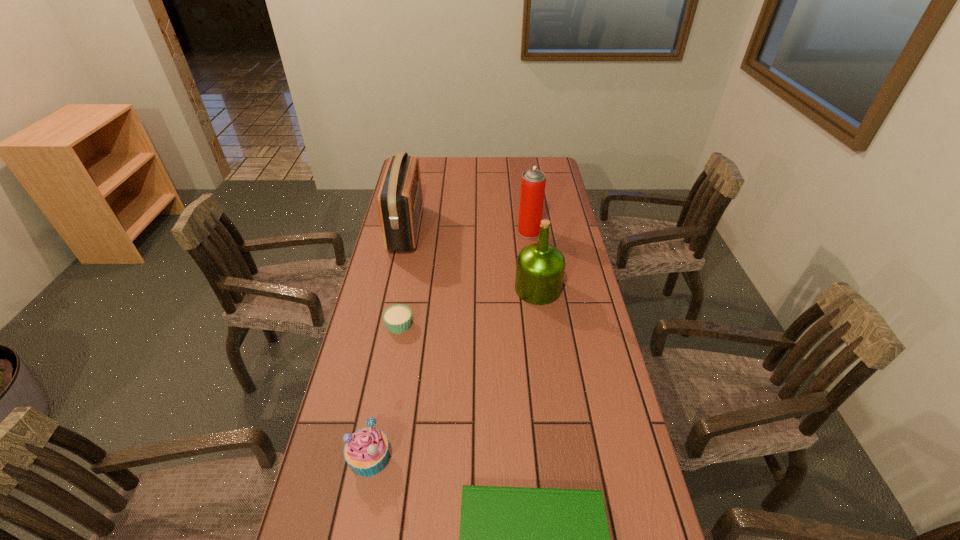
The width and height of the screenshot is (960, 540). I want to click on blank space that satisfies the following two spatial constraints: 1. on the front-facing side of the radio receiver; 2. on the left side of the second shortest object, so click(386, 325).

Find the location of `free space that satisfies the following two spatial constraints: 1. on the front-facing side of the fifth tallest object; 2. on the right side of the radio receiver`. free space that satisfies the following two spatial constraints: 1. on the front-facing side of the fifth tallest object; 2. on the right side of the radio receiver is located at coordinates (386, 325).

Find the location of a particular element. The width and height of the screenshot is (960, 540). free spot that satisfies the following two spatial constraints: 1. on the back side of the aerosol can; 2. on the front-facing side of the radio receiver is located at coordinates (529, 229).

Where is `vacant area in the image that satisfies the following two spatial constraints: 1. on the front-facing side of the aerosol can; 2. on the left side of the radio receiver`? This screenshot has width=960, height=540. vacant area in the image that satisfies the following two spatial constraints: 1. on the front-facing side of the aerosol can; 2. on the left side of the radio receiver is located at coordinates tap(406, 232).

The image size is (960, 540). Find the location of `free location that satisfies the following two spatial constraints: 1. on the front-facing side of the radio receiver; 2. on the back side of the muffin`. free location that satisfies the following two spatial constraints: 1. on the front-facing side of the radio receiver; 2. on the back side of the muffin is located at coordinates (358, 458).